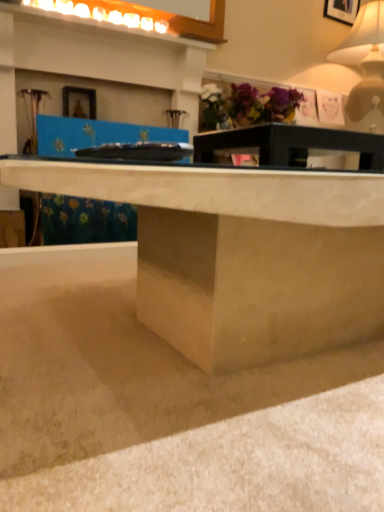
Question: From the image's perspective, is matte concrete desk at center above matte black table at center?

Choices:
 (A) no
 (B) yes

Answer: (A)

Question: Is matte concrete desk at center looking in the opposite direction of matte black table at center?

Choices:
 (A) yes
 (B) no

Answer: (B)

Question: From a real-world perspective, is matte concrete desk at center positioned over matte black table at center based on gravity?

Choices:
 (A) yes
 (B) no

Answer: (B)

Question: Are matte concrete desk at center and matte black table at center beside each other?

Choices:
 (A) no
 (B) yes

Answer: (A)

Question: Does matte concrete desk at center appear on the right side of matte black table at center?

Choices:
 (A) yes
 (B) no

Answer: (B)

Question: From the image's perspective, is matte concrete desk at center located beneath matte black table at center?

Choices:
 (A) yes
 (B) no

Answer: (A)

Question: Considering the relative sizes of matte concrete desk at center and smooth concrete at lower center in the image provided, is matte concrete desk at center shorter than smooth concrete at lower center?

Choices:
 (A) yes
 (B) no

Answer: (B)

Question: From the image's perspective, is matte concrete desk at center below smooth concrete at lower center?

Choices:
 (A) no
 (B) yes

Answer: (A)

Question: Considering the relative sizes of matte concrete desk at center and smooth concrete at lower center in the image provided, is matte concrete desk at center thinner than smooth concrete at lower center?

Choices:
 (A) yes
 (B) no

Answer: (A)

Question: From a real-world perspective, is matte concrete desk at center positioned under smooth concrete at lower center based on gravity?

Choices:
 (A) yes
 (B) no

Answer: (B)

Question: Does matte concrete desk at center appear on the left side of smooth concrete at lower center?

Choices:
 (A) yes
 (B) no

Answer: (B)

Question: Is matte concrete desk at center located outside smooth concrete at lower center?

Choices:
 (A) yes
 (B) no

Answer: (A)

Question: Can you confirm if matte white table lamp at upper right is shorter than matte concrete desk at center?

Choices:
 (A) yes
 (B) no

Answer: (B)